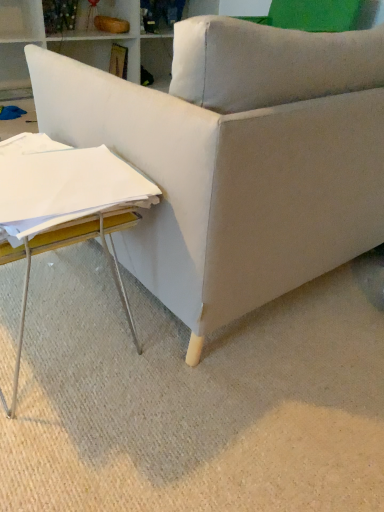
Looking at this image, measure the distance between point (63, 179) and camera.

They are 31.61 inches apart.

Image resolution: width=384 pixels, height=512 pixels. What do you see at coordinates (67, 204) in the screenshot?
I see `white wood table at lower left` at bounding box center [67, 204].

Find the location of a particular element. beige fabric couch at lower right is located at coordinates (236, 159).

Locate an element on the screen. white paper at lower left is located at coordinates (62, 185).

Is white wood table at lower left at the left side of white paper at lower left?

Yes, white wood table at lower left is to the left of white paper at lower left.

Is white wood table at lower left thinner than white paper at lower left?

In fact, white wood table at lower left might be wider than white paper at lower left.

Looking at the image, does white wood table at lower left seem bigger or smaller compared to white paper at lower left?

white wood table at lower left is bigger than white paper at lower left.

From the image's perspective, is white wood table at lower left over white paper at lower left?

No.

Considering the sizes of beige fabric couch at lower right and white paper at lower left in the image, is beige fabric couch at lower right bigger or smaller than white paper at lower left?

Clearly, beige fabric couch at lower right is larger in size than white paper at lower left.

Is white paper at lower left a part of beige fabric couch at lower right?

Definitely not — white paper at lower left is not inside beige fabric couch at lower right.

Is beige fabric couch at lower right shorter than white paper at lower left?

Indeed, beige fabric couch at lower right has a lesser height compared to white paper at lower left.

Considering the positions of objects beige fabric couch at lower right and white paper at lower left in the image provided, who is more to the left, beige fabric couch at lower right or white paper at lower left?

From the viewer's perspective, white paper at lower left appears more on the left side.

Is white paper at lower left in front of or behind beige fabric couch at lower right in the image?

In the image, white paper at lower left appears behind beige fabric couch at lower right.

In the scene shown: Is white paper at lower left thinner than beige fabric couch at lower right?

Yes.

Can you confirm if white paper at lower left is taller than beige fabric couch at lower right?

Yes.

How different are the orientations of white paper at lower left and white wood table at lower left in degrees?

There is a 0.826-degree angle between the facing directions of white paper at lower left and white wood table at lower left.

In the scene shown: Can you confirm if white paper at lower left is shorter than white wood table at lower left?

Yes.

Does white paper at lower left have a greater width compared to white wood table at lower left?

No, white paper at lower left is not wider than white wood table at lower left.

Is white paper at lower left next to white wood table at lower left?

Yes, white paper at lower left is touching white wood table at lower left.

Can you confirm if white wood table at lower left is bigger than beige fabric couch at lower right?

Incorrect, white wood table at lower left is not larger than beige fabric couch at lower right.

Is white wood table at lower left not near beige fabric couch at lower right?

No.

In the scene shown: What's the angular difference between white wood table at lower left and beige fabric couch at lower right's facing directions?

91.9 degrees separate the facing orientations of white wood table at lower left and beige fabric couch at lower right.

From a real-world perspective, between beige fabric couch at lower right and white wood table at lower left, who is vertically lower?

In real-world perspective, beige fabric couch at lower right is lower.

Is beige fabric couch at lower right turned away from white wood table at lower left?

No, white wood table at lower left is not at the back of beige fabric couch at lower right.

Is point (296, 51) closer or farther from the camera than point (116, 209)?

Point (296, 51).

From the image's perspective, is beige fabric couch at lower right above or below white wood table at lower left?

beige fabric couch at lower right is situated higher than white wood table at lower left in the image.

This screenshot has height=512, width=384. Identify the location of sheet in front of the white wood table at lower left. (62, 185).

You are a GUI agent. You are given a task and a screenshot of the screen. Output one action in this format:
    pyautogui.click(x=<x>, y=<y>)
    Task: Click on the sheet behind the beige fabric couch at lower right
    The width and height of the screenshot is (384, 512).
    Given the screenshot: What is the action you would take?
    pyautogui.click(x=62, y=185)

Based on their spatial positions, is white paper at lower left or white wood table at lower left further from beige fabric couch at lower right?

white paper at lower left is positioned further to the anchor beige fabric couch at lower right.

When comparing their distances from white paper at lower left, does white wood table at lower left or beige fabric couch at lower right seem closer?

The object closer to white paper at lower left is white wood table at lower left.

Looking at the image, which one is located further to white wood table at lower left, white paper at lower left or beige fabric couch at lower right?

beige fabric couch at lower right lies further to white wood table at lower left than the other object.

From the picture: Estimate the real-world distances between objects in this image. Which object is further from white wood table at lower left, beige fabric couch at lower right or white paper at lower left?

beige fabric couch at lower right lies further to white wood table at lower left than the other object.

Considering their positions, is beige fabric couch at lower right positioned further to white paper at lower left than white wood table at lower left?

beige fabric couch at lower right is further to white paper at lower left.

Looking at the image, which one is located further to beige fabric couch at lower right, white wood table at lower left or white paper at lower left?

white paper at lower left is further to beige fabric couch at lower right.

Locate an element on the screen. The width and height of the screenshot is (384, 512). sheet that lies between beige fabric couch at lower right and white wood table at lower left from top to bottom is located at coordinates [x=62, y=185].